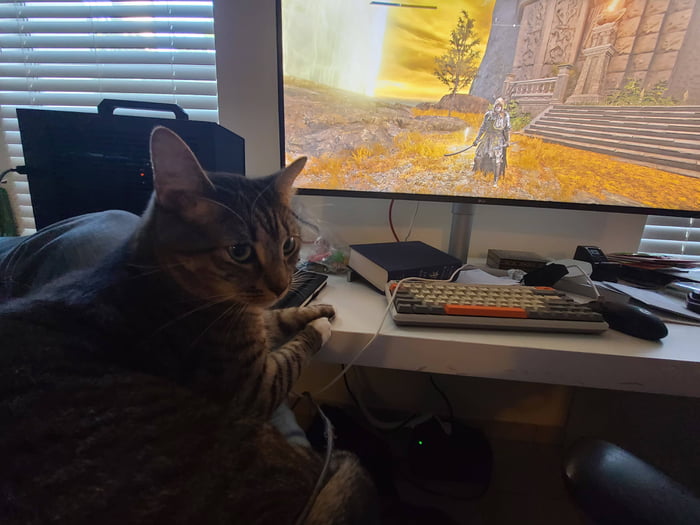
Image resolution: width=700 pixels, height=525 pixels. Find the location of `top right corner of ipad`. top right corner of ipad is located at coordinates (322, 276).